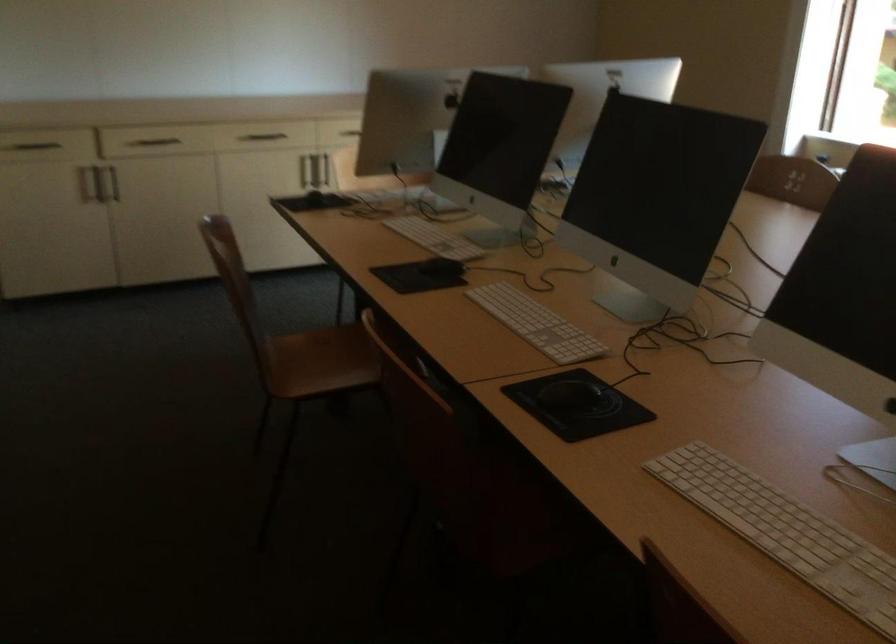
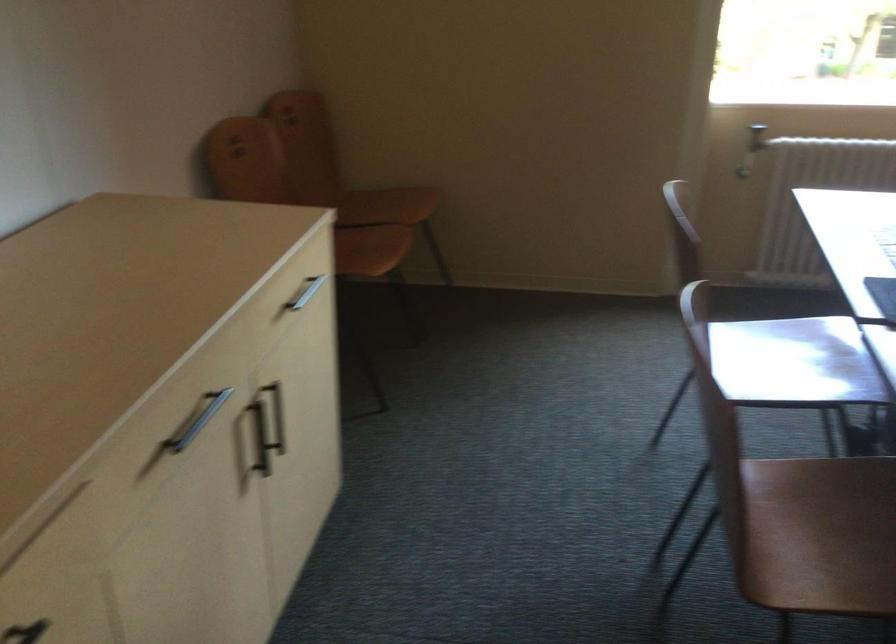
Where in the second image is the point corresponding to point 268,136 from the first image?

(197, 420)